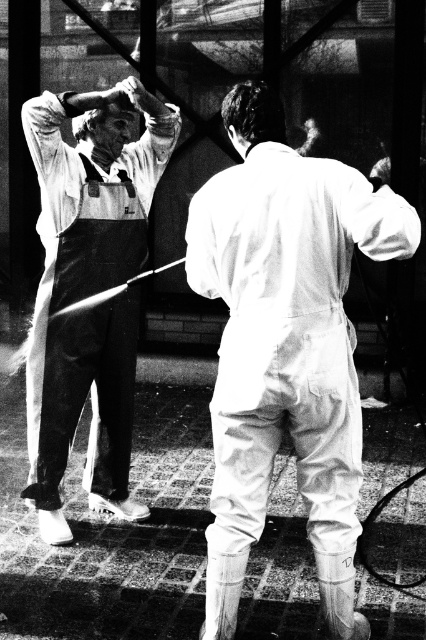
Question: Can you confirm if white matte jumpsuit at center is positioned above matte white overalls at left?

Choices:
 (A) yes
 (B) no

Answer: (B)

Question: Which of the following is the farthest from the observer?

Choices:
 (A) white matte jumpsuit at center
 (B) matte white overalls at left

Answer: (B)

Question: Which of the following is the closest to the observer?

Choices:
 (A) (293, 401)
 (B) (132, 88)

Answer: (A)

Question: Can you confirm if white matte jumpsuit at center is thinner than matte white overalls at left?

Choices:
 (A) yes
 (B) no

Answer: (B)

Question: Can you confirm if white matte jumpsuit at center is thinner than matte white overalls at left?

Choices:
 (A) yes
 (B) no

Answer: (B)